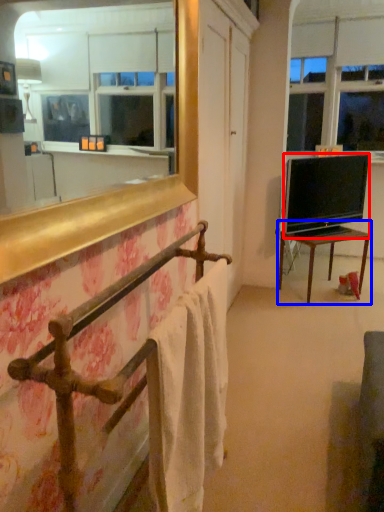
Question: Which object is closer to the camera taking this photo, television (highlighted by a red box) or table (highlighted by a blue box)?

Choices:
 (A) television
 (B) table

Answer: (A)